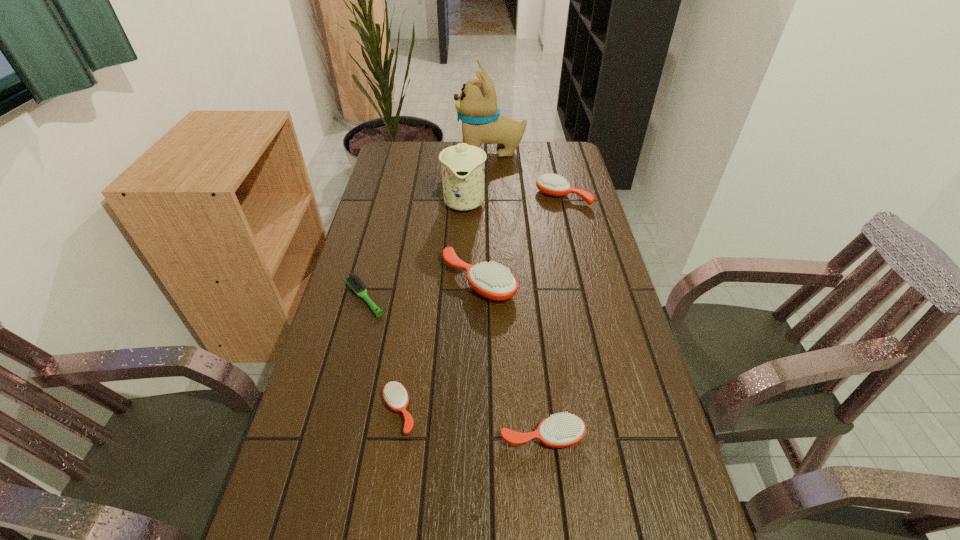
You are a GUI agent. You are given a task and a screenshot of the screen. Output one action in this format:
    pyautogui.click(x=<x>, y=<y>)
    Task: Click on the sixth object from right to left
    Image resolution: width=960 pixels, height=540 pixels.
    Given the screenshot: What is the action you would take?
    pyautogui.click(x=395, y=395)

Image resolution: width=960 pixels, height=540 pixels. Identify the location of the shortest hairbrush. (353, 281).

Locate an element on the screen. This screenshot has width=960, height=540. the leftmost object is located at coordinates (353, 281).

This screenshot has height=540, width=960. In order to click on blank space located on the face of the farthest object in this screenshot , I will do `click(444, 151)`.

Identify the location of free spot located 0.300m on the face of the farthest object. (385, 151).

What are the coordinates of `vacant region located on the face of the farthest object` in the screenshot? It's located at (387, 151).

Locate an element on the screen. free space located on the spout of the sixth shortest object is located at coordinates (462, 258).

I want to click on vacant space located on the left of the third nearest orange hairbrush, so click(408, 281).

The height and width of the screenshot is (540, 960). I want to click on vacant space positioned 0.270m on the back of the farthest orange hairbrush, so (552, 150).

I want to click on free space located on the right of the third shortest hairbrush, so click(667, 436).